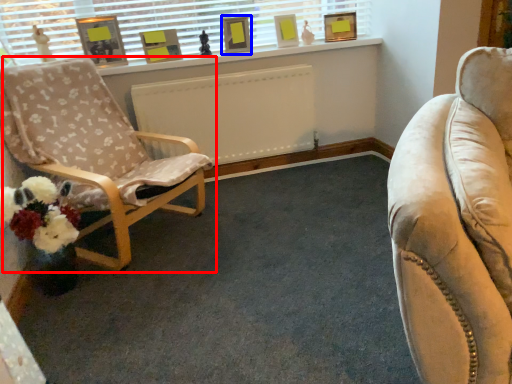
Question: Among these objects, which one is farthest to the camera, chair (highlighted by a red box) or picture frame (highlighted by a blue box)?

Choices:
 (A) chair
 (B) picture frame

Answer: (B)